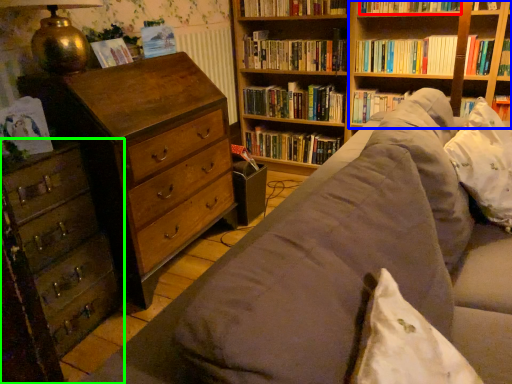
Question: Which object is the farthest from book (highlighted by a red box)? Choose among these: shelf (highlighted by a blue box) or chest of drawers (highlighted by a green box).

Choices:
 (A) shelf
 (B) chest of drawers

Answer: (B)